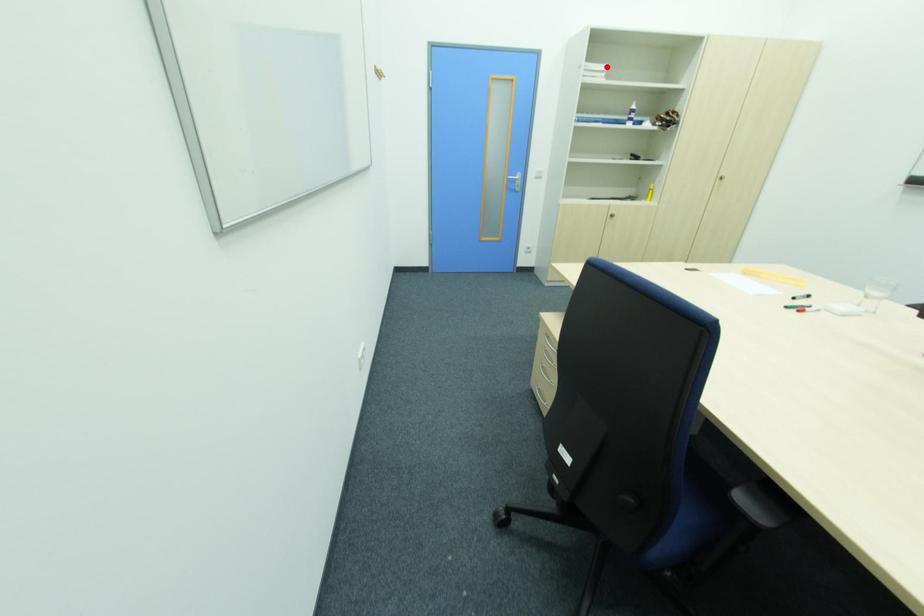
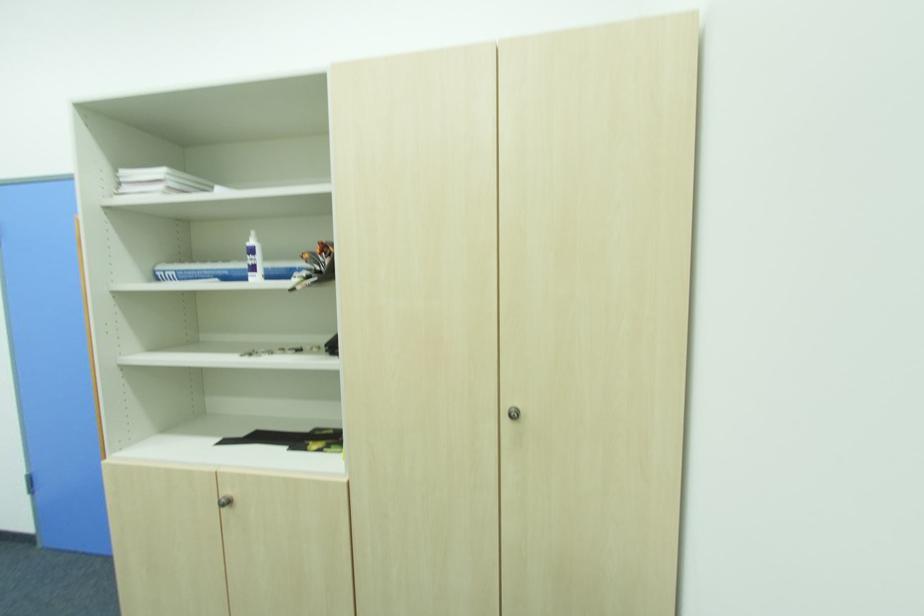
The point at the highlighted location is marked in the first image. Where is the corresponding point in the second image?

(161, 172)